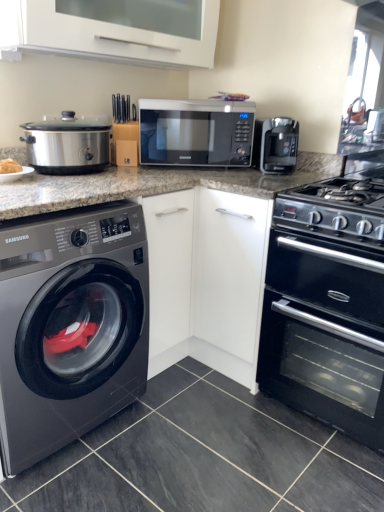
Question: From a real-world perspective, relative to stainless steel slow cooker at left, is satin silver microwave at center vertically above or below?

Choices:
 (A) above
 (B) below

Answer: (A)

Question: Choose the correct answer: Is satin silver microwave at center inside stainless steel slow cooker at left or outside it?

Choices:
 (A) outside
 (B) inside

Answer: (A)

Question: Estimate the real-world distances between objects in this image. Which object is closer to the black matte oven at lower right?

Choices:
 (A) black metallic gas stove at right
 (B) satin black coffee maker at upper right
 (C) satin black washing machine at left
 (D) stainless steel slow cooker at left
 (E) satin silver microwave at center

Answer: (A)

Question: Estimate the real-world distances between objects in this image. Which object is closer to the stainless steel slow cooker at left?

Choices:
 (A) satin silver microwave at center
 (B) black metallic gas stove at right
 (C) white glossy vent at upper center
 (D) satin black coffee maker at upper right
 (E) black matte oven at lower right

Answer: (A)